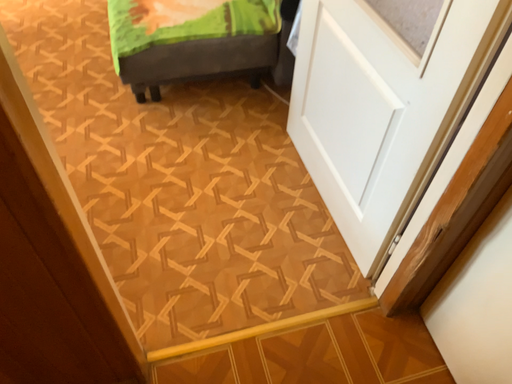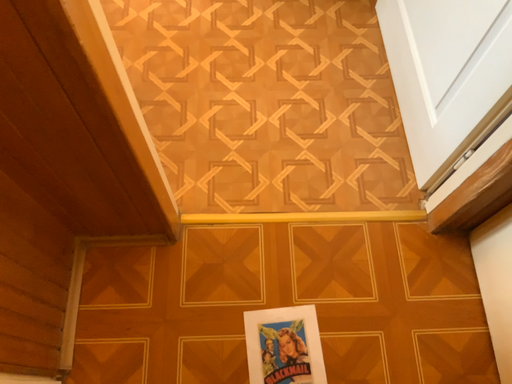
Question: Which way did the camera rotate in the video?

Choices:
 (A) rotated right
 (B) rotated left

Answer: (B)